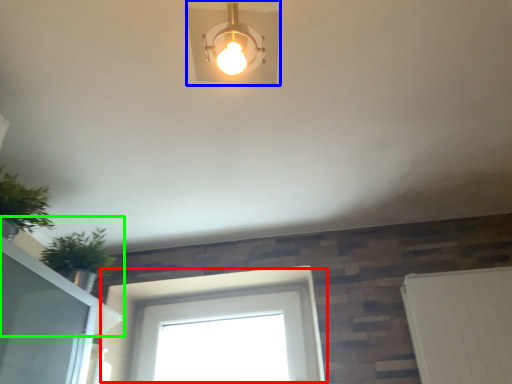
Question: Estimate the real-world distances between objects in this image. Which object is farther from window (highlighted by a red box), lamp (highlighted by a blue box) or window sill (highlighted by a green box)?

Choices:
 (A) lamp
 (B) window sill

Answer: (A)